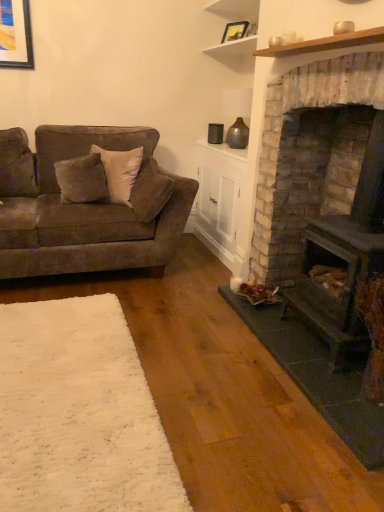
Question: Is brick textured wood burning stove at right taller than matte black picture frame at upper center?

Choices:
 (A) no
 (B) yes

Answer: (B)

Question: Does brick textured wood burning stove at right turn towards matte black picture frame at upper center?

Choices:
 (A) yes
 (B) no

Answer: (B)

Question: Can you confirm if brick textured wood burning stove at right is thinner than matte black picture frame at upper center?

Choices:
 (A) yes
 (B) no

Answer: (B)

Question: From the image's perspective, is brick textured wood burning stove at right over matte black picture frame at upper center?

Choices:
 (A) yes
 (B) no

Answer: (B)

Question: Is brick textured wood burning stove at right at the left side of matte black picture frame at upper center?

Choices:
 (A) yes
 (B) no

Answer: (B)

Question: Can you confirm if brick textured wood burning stove at right is bigger than matte black picture frame at upper center?

Choices:
 (A) yes
 (B) no

Answer: (A)

Question: Does matte black picture frame at upper center have a greater width compared to velvet brown couch at left?

Choices:
 (A) yes
 (B) no

Answer: (B)

Question: From a real-world perspective, is matte black picture frame at upper center under velvet brown couch at left?

Choices:
 (A) yes
 (B) no

Answer: (B)

Question: Would you say matte black picture frame at upper center is outside velvet brown couch at left?

Choices:
 (A) no
 (B) yes

Answer: (B)

Question: Does matte black picture frame at upper center have a greater height compared to velvet brown couch at left?

Choices:
 (A) yes
 (B) no

Answer: (B)

Question: From the image's perspective, does matte black picture frame at upper center appear higher than velvet brown couch at left?

Choices:
 (A) yes
 (B) no

Answer: (A)

Question: From the image's perspective, is matte black picture frame at upper center beneath velvet brown couch at left?

Choices:
 (A) no
 (B) yes

Answer: (A)

Question: From the image's perspective, is matte black picture frame at upper center over white wood shelf at upper center?

Choices:
 (A) yes
 (B) no

Answer: (B)